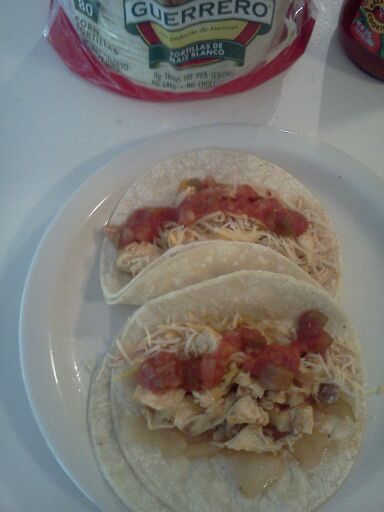
Locate an element on the screen. surface is located at coordinates (48, 169).